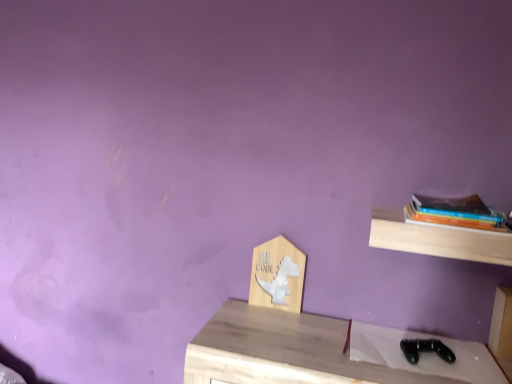
Question: Considering the relative sizes of light wood shelf at upper right, the first shelf when ordered from right to left, and wooden sign at center, which is the second shelf from front to back, in the image provided, is light wood shelf at upper right, the first shelf when ordered from right to left, smaller than wooden sign at center, which is the second shelf from front to back,?

Choices:
 (A) no
 (B) yes

Answer: (A)

Question: Is light wood shelf at upper right, which is the first shelf in front-to-back order, with wooden sign at center, the first shelf when ordered from back to front?

Choices:
 (A) no
 (B) yes

Answer: (A)

Question: Is light wood shelf at upper right, the 2th shelf from the left, wider than wooden sign at center, the 1th shelf viewed from the left?

Choices:
 (A) no
 (B) yes

Answer: (B)

Question: Is light wood shelf at upper right, the first shelf when ordered from right to left, looking in the opposite direction of wooden sign at center, the first shelf when ordered from back to front?

Choices:
 (A) no
 (B) yes

Answer: (A)

Question: From a real-world perspective, is light wood shelf at upper right, the 2th shelf from the left, positioned over wooden sign at center, the first shelf when ordered from back to front, based on gravity?

Choices:
 (A) yes
 (B) no

Answer: (A)

Question: From a real-world perspective, is hardcover books at right above or below light wood shelf at upper right, the first shelf when ordered from right to left?

Choices:
 (A) below
 (B) above

Answer: (B)

Question: In terms of size, does hardcover books at right appear bigger or smaller than light wood shelf at upper right, the 2th shelf from the left?

Choices:
 (A) big
 (B) small

Answer: (B)

Question: Considering the positions of point (475, 206) and point (463, 248), is point (475, 206) closer or farther from the camera than point (463, 248)?

Choices:
 (A) farther
 (B) closer

Answer: (A)

Question: Do you think hardcover books at right is within light wood shelf at upper right, the 2th shelf from the left, or outside of it?

Choices:
 (A) outside
 (B) inside

Answer: (A)

Question: From a real-world perspective, is hardcover books at right positioned above or below wooden sign at center, the 1th shelf viewed from the left?

Choices:
 (A) above
 (B) below

Answer: (A)

Question: From the image's perspective, is hardcover books at right located above or below wooden sign at center, the first shelf when ordered from back to front?

Choices:
 (A) above
 (B) below

Answer: (A)

Question: In the image, is hardcover books at right on the left side or the right side of wooden sign at center, the first shelf when ordered from back to front?

Choices:
 (A) right
 (B) left

Answer: (A)

Question: Considering the positions of point (455, 206) and point (293, 296), is point (455, 206) closer or farther from the camera than point (293, 296)?

Choices:
 (A) closer
 (B) farther

Answer: (A)

Question: Which is correct: wooden sign at center, the 2th shelf in the right-to-left sequence, is inside light wood shelf at upper right, the 2th shelf from the left, or outside of it?

Choices:
 (A) inside
 (B) outside

Answer: (B)

Question: Considering their positions, is wooden sign at center, the first shelf when ordered from back to front, located in front of or behind light wood shelf at upper right, the first shelf when ordered from right to left?

Choices:
 (A) front
 (B) behind

Answer: (B)